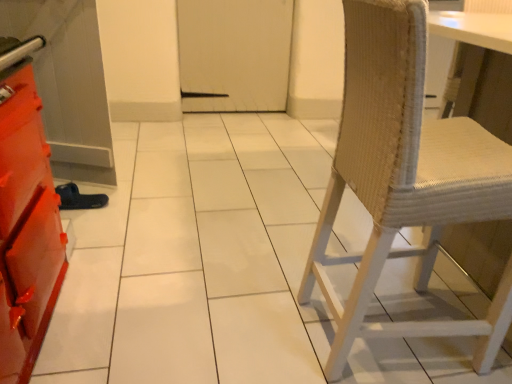
What do you see at coordinates (405, 178) in the screenshot?
I see `woven beige chair at right` at bounding box center [405, 178].

Locate an element on the screen. woven beige chair at right is located at coordinates (405, 178).

In the scene shown: Measure the distance between woven beige chair at right and camera.

A distance of 76.64 centimeters exists between woven beige chair at right and camera.

At what (x,y) coordinates should I click in order to perform the action: click on woven beige chair at right. Please return your answer as a coordinate pair (x, y). Looking at the image, I should click on (405, 178).